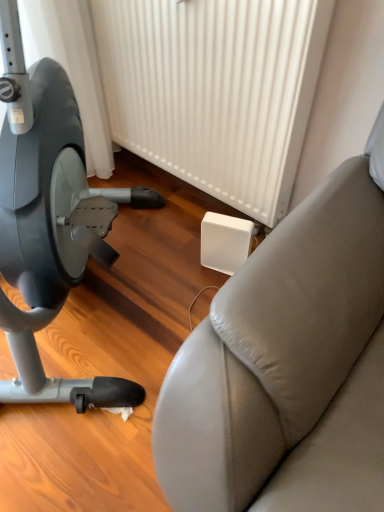
This screenshot has width=384, height=512. What are the coordinates of `vacant space underneath matte gray stationary bicycle at left (from a real-world perspective)` in the screenshot? It's located at (105, 306).